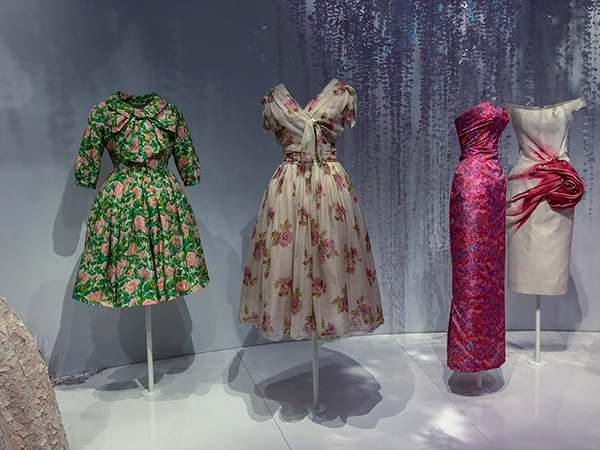
Where is `grey wall`? The image size is (600, 450). grey wall is located at coordinates (19, 145).